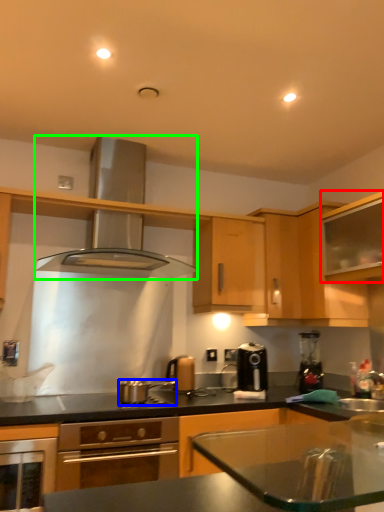
Question: Based on their relative distances, which object is nearer to cabinetry (highlighted by a red box)? Choose from kitchen appliance (highlighted by a blue box) and exhaust hood (highlighted by a green box).

Choices:
 (A) kitchen appliance
 (B) exhaust hood

Answer: (B)